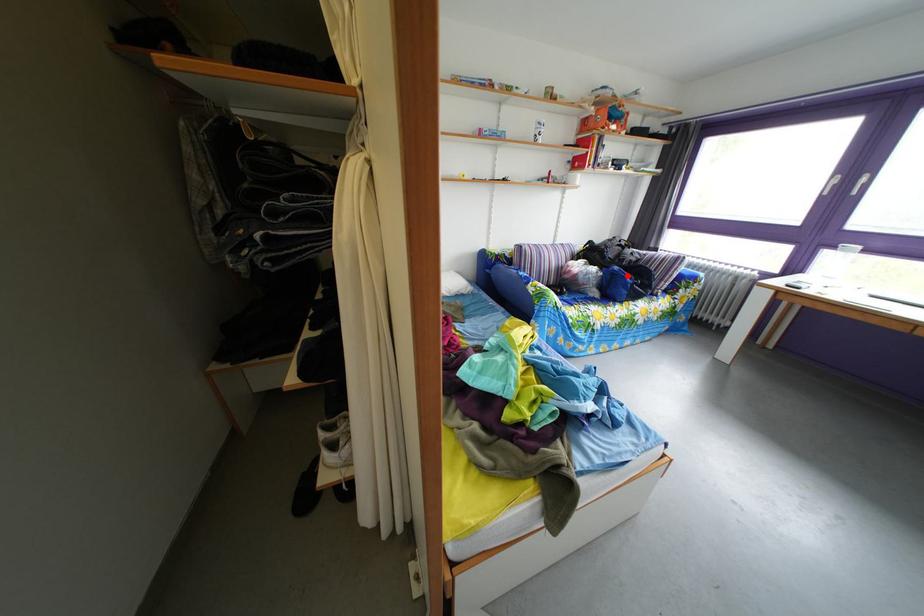
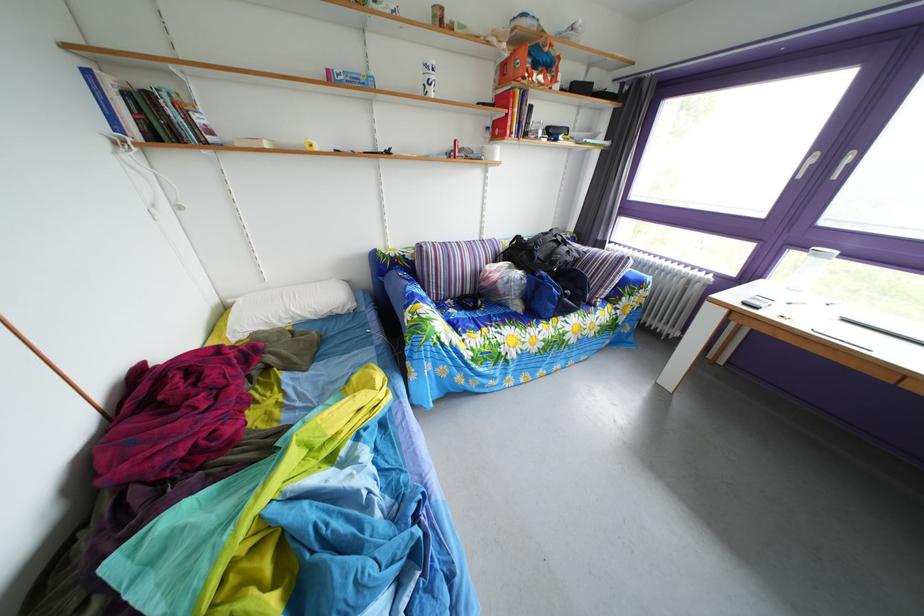
Question: I am providing you with two images of the same scene from different viewpoints. Image1 has a red point marked. In image2, the corresponding 3D location appears at what relative position? Reply with the corresponding letter.

Choices:
 (A) Closer
 (B) Farther

Answer: (B)